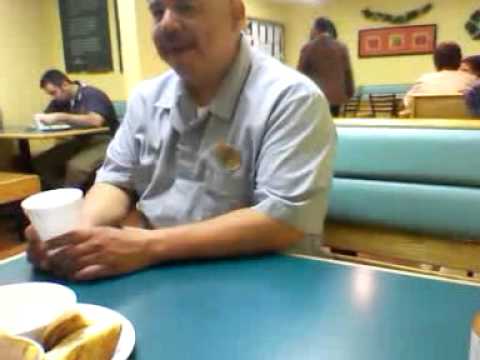
Where is `yellow wall`? This screenshot has width=480, height=360. yellow wall is located at coordinates (30, 29), (410, 64), (301, 21).